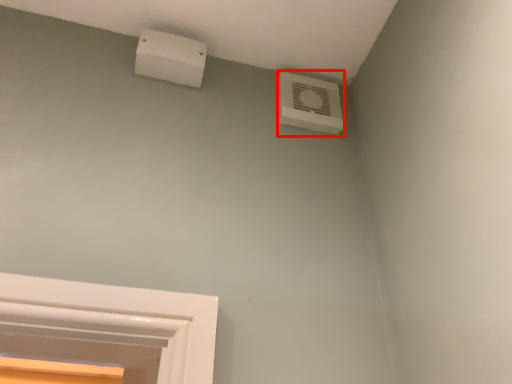
Question: From the image's perspective, what is the correct spatial relationship of air conditioning (annotated by the red box) in relation to air conditioning?

Choices:
 (A) below
 (B) above

Answer: (A)